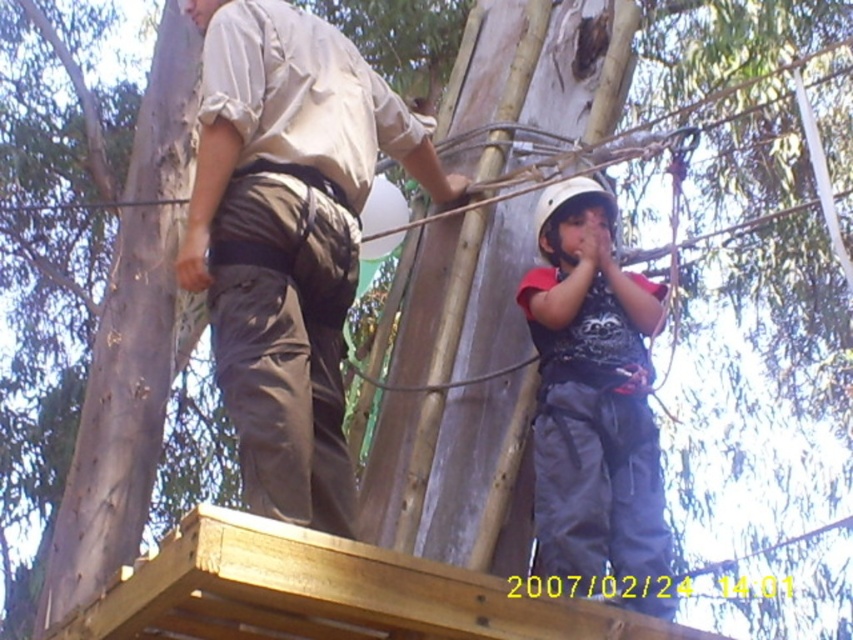
Question: Observing the image, what is the correct spatial positioning of khaki cotton pants at upper center in reference to dark gray fabric pants at center?

Choices:
 (A) below
 (B) above

Answer: (B)

Question: Which point appears closest to the camera in this image?

Choices:
 (A) (648, 307)
 (B) (306, 500)

Answer: (B)

Question: Can you confirm if khaki cotton pants at upper center is smaller than dark gray fabric pants at center?

Choices:
 (A) no
 (B) yes

Answer: (A)

Question: Is khaki cotton pants at upper center positioned at the back of dark gray fabric pants at center?

Choices:
 (A) no
 (B) yes

Answer: (A)

Question: Which of the following is the closest to the observer?

Choices:
 (A) dark gray fabric pants at center
 (B) khaki cotton pants at upper center

Answer: (B)

Question: Which point appears closest to the camera in this image?

Choices:
 (A) (308, 449)
 (B) (608, 248)

Answer: (A)